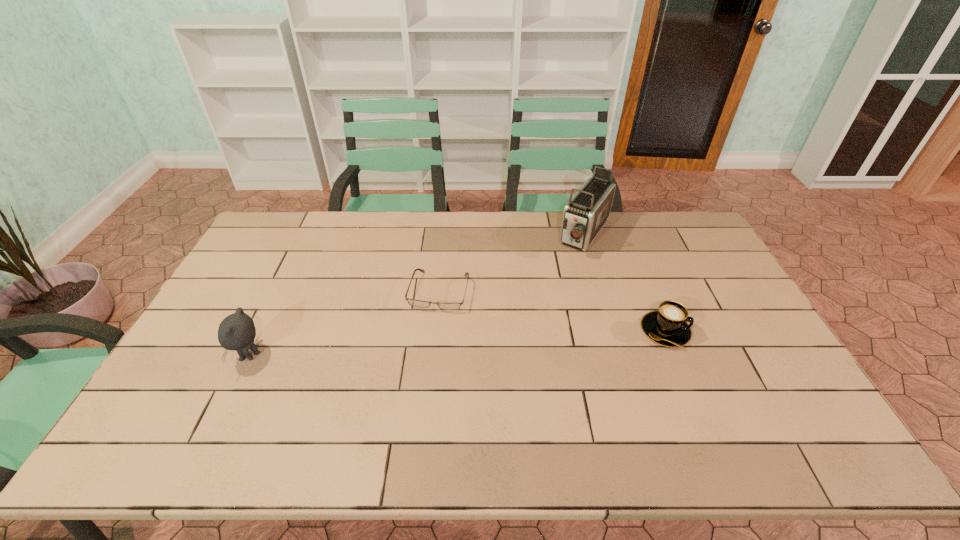
This screenshot has height=540, width=960. I want to click on vacant area between the camcorder and the shortest object, so click(x=513, y=263).

Locate an element on the screen. The width and height of the screenshot is (960, 540). object that is the closest to the cappuccino is located at coordinates (585, 214).

This screenshot has width=960, height=540. Find the location of `object that stands as the third closest to the camcorder`. object that stands as the third closest to the camcorder is located at coordinates (237, 331).

Identify the location of vacant space that satisfies the following two spatial constraints: 1. on the front side of the shortest object; 2. on the right side of the third tallest object. The image size is (960, 540). (435, 332).